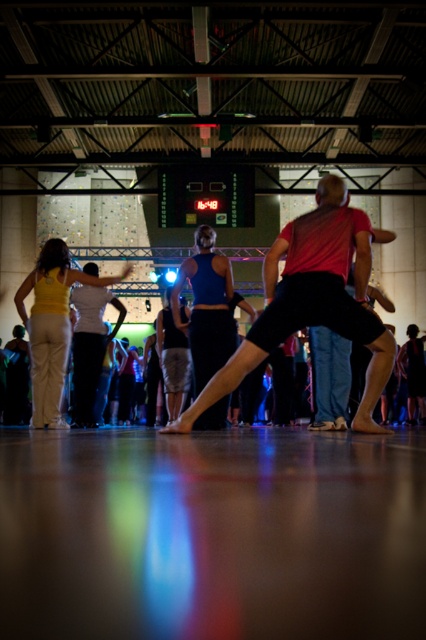
You are a photographer positioned at the back of the hall, aiming to capture a photo of both the matte black shorts at center and the matte yellow tank top at center in the same frame. Given that your camera has a maximum focus range of 8 feet, will you be able to capture both subjects clearly without moving?

The distance between the matte black shorts at center and the matte yellow tank top at center is 7.73 feet, which is within the camera maximum focus range of 8 feet. Therefore, you can capture both subjects clearly without moving.

You are standing at the center of the hall and see two points marked on the climbing wall. The first point is at coordinates point (51, 246) and the second is at point (198, 426). Which point is closer to you?

Point (198, 426) is closer to you because it is less further away than point (51, 246).